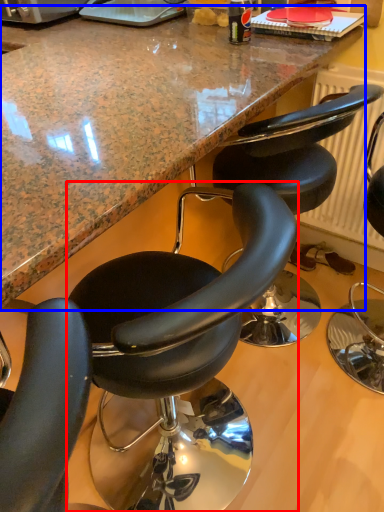
Question: Which object is further to the camera taking this photo, chair (highlighted by a red box) or countertop (highlighted by a blue box)?

Choices:
 (A) chair
 (B) countertop

Answer: (A)